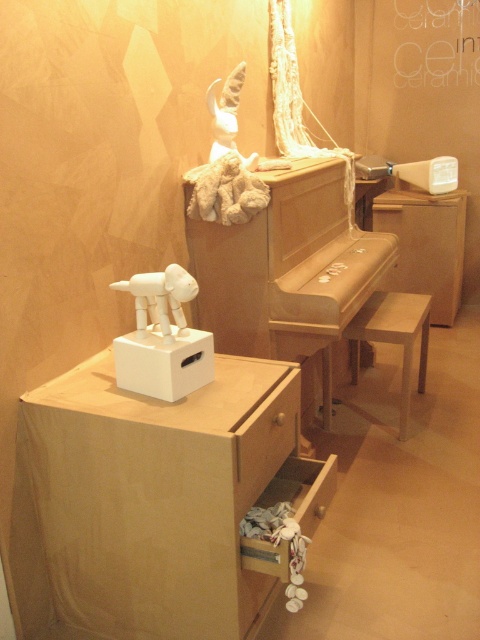
You are standing in the room and want to place a new decorative item on the piano. The piano is at the center of the room. Where should you place the new item so it is to the right of the fuzzy beige stuffed animal at upper center?

The fuzzy beige stuffed animal at upper center is located at point (226, 192). To place the new item to the right of it, you should position it at a coordinate with an x value greater than 0.300 while maintaining the same y value of 0.471.

You are standing in the display area and want to place a new item exactly at point (226, 192). However, there is already an object there. What is the object currently occupying that location?

The fuzzy beige stuffed animal at upper center is located at point (226, 192).